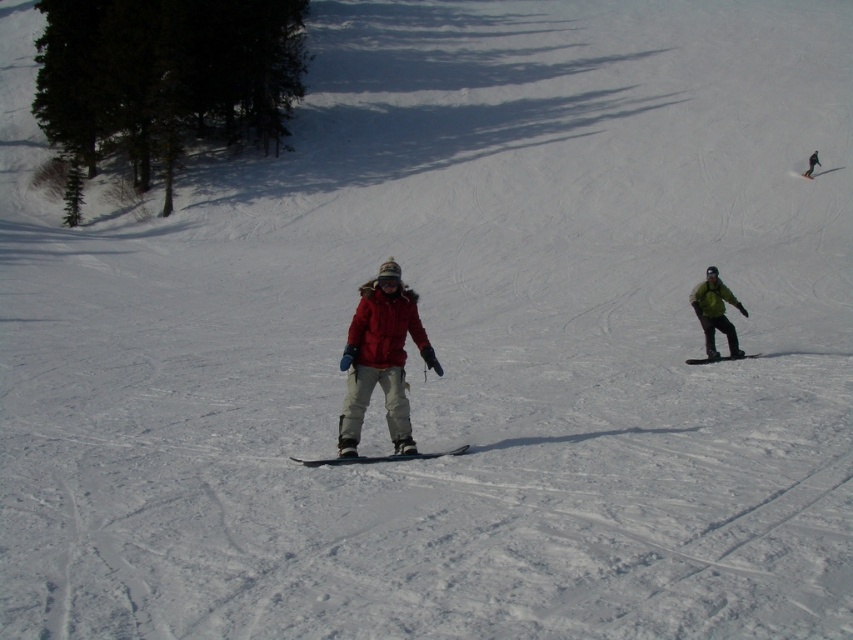
You are a photographer trying to capture a shot of the matte red jacket at center and the matte black snowboard at center. Since you want to focus on the jacket, which object should you adjust your camera to prioritize in terms of depth of field?

The matte red jacket at center is closer to the viewer than the matte black snowboard at center, so you should adjust the camera to prioritize the matte red jacket at center in the depth of field to ensure it is in focus while the snowboard may be slightly blurred.

You are a snowboard instructor observing the scene. You notice the green matte snowboarder at right and the matte black snowboard at right. Which object is positioned further away from you?

The matte black snowboard at right is positioned behind the green matte snowboarder at right, so it is further away from you.